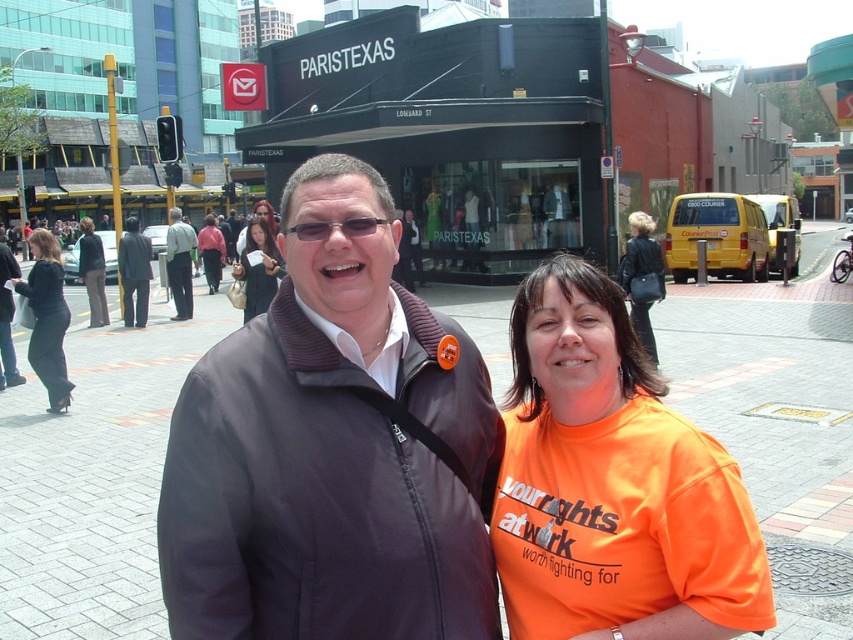
You are a fashion designer trying to create a cohesive outfit using the matte brown sweater at center and the dark gray pants at center. Based on their sizes, which item should you adjust to ensure they balance well together?

The matte brown sweater at center occupies less space than dark gray pants at center, so you should adjust the size of the matte brown sweater to be larger to balance with the dark gray pants at center.

In the scene shown: You are a photographer trying to capture both the dark gray jacket at center and the matte brown sweater at center in a single frame. Given their positions, can you position yourself so that neither object blocks the other in the photo?

The dark gray jacket at center is in front of the matte brown sweater at center, so you cannot position yourself to capture both without one blocking the other. Adjust your angle to ensure they are side by side or reposition the subjects.